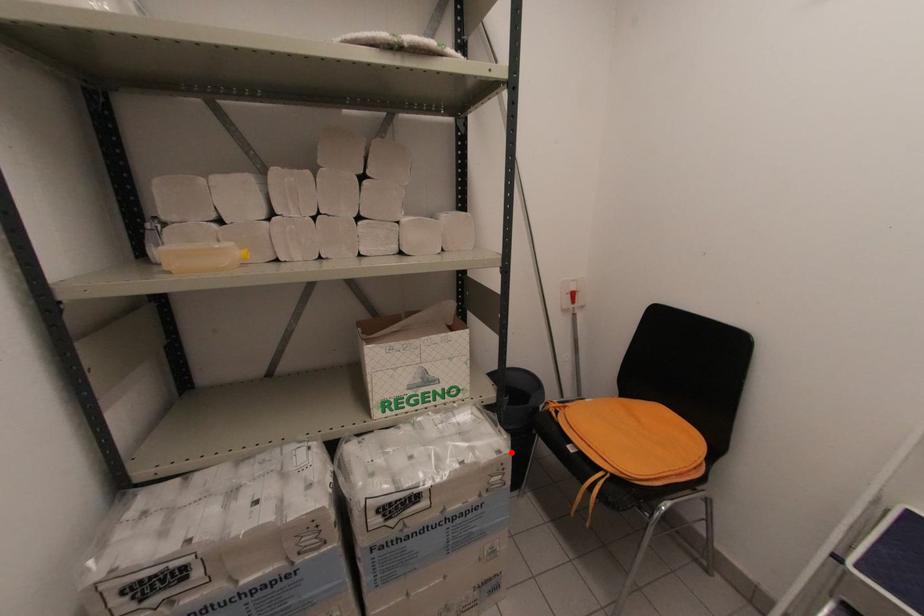
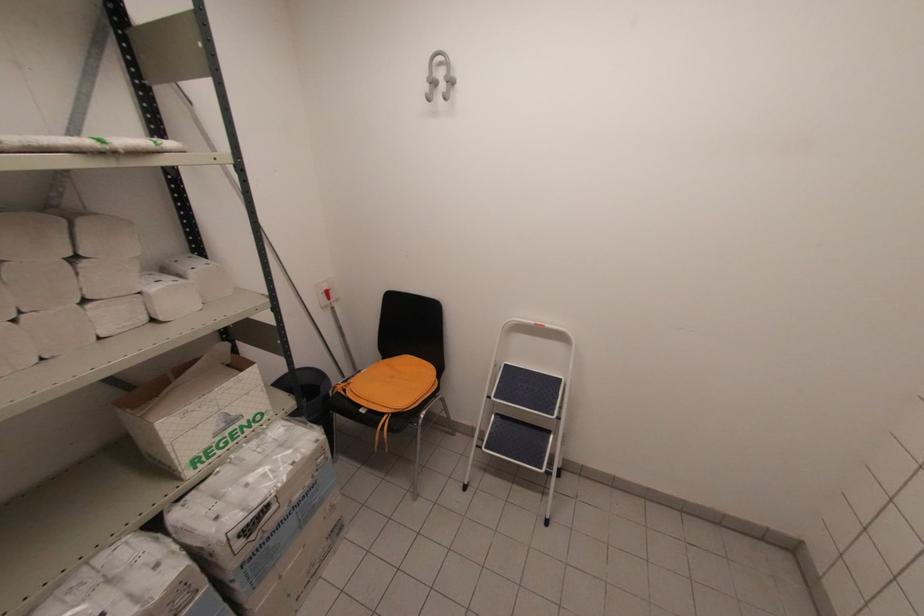
Question: I am providing you with two images of the same scene from different viewpoints. A red point is shown in image1. For the corresponding object point in image2, is it positioned nearer or farther from the camera?

Choices:
 (A) Nearer
 (B) Farther

Answer: (A)